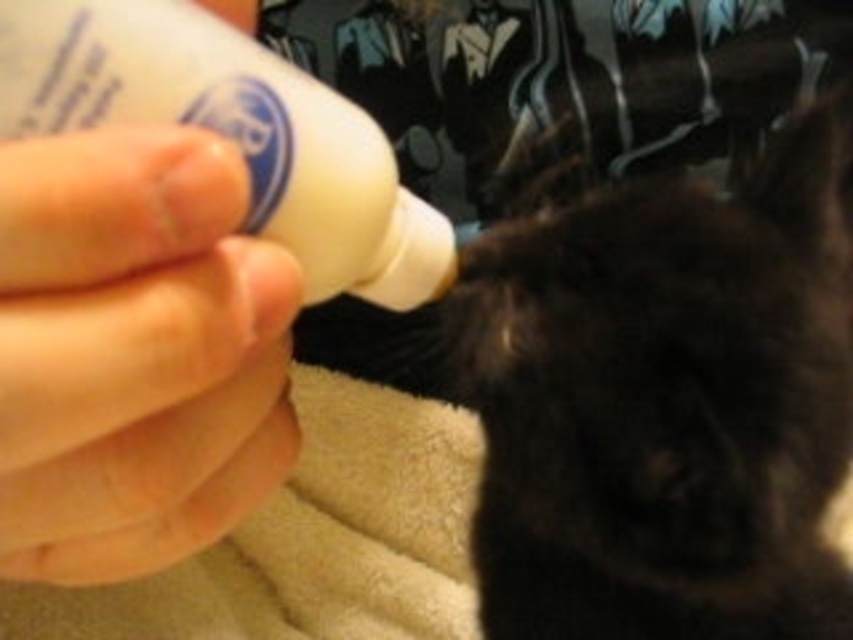
Question: Which object appears closest to the camera in this image?

Choices:
 (A) white plastic bottle at upper left
 (B) black fur cat at center

Answer: (A)

Question: Can you confirm if black fur cat at center is smaller than white plastic bottle at upper left?

Choices:
 (A) no
 (B) yes

Answer: (A)

Question: Which of the following is the farthest from the observer?

Choices:
 (A) black fur cat at center
 (B) white plastic bottle at upper left

Answer: (A)

Question: Can you confirm if black fur cat at center is positioned below white plastic bottle at upper left?

Choices:
 (A) yes
 (B) no

Answer: (A)

Question: From the image, what is the correct spatial relationship of black fur cat at center in relation to white plastic bottle at upper left?

Choices:
 (A) below
 (B) above

Answer: (A)